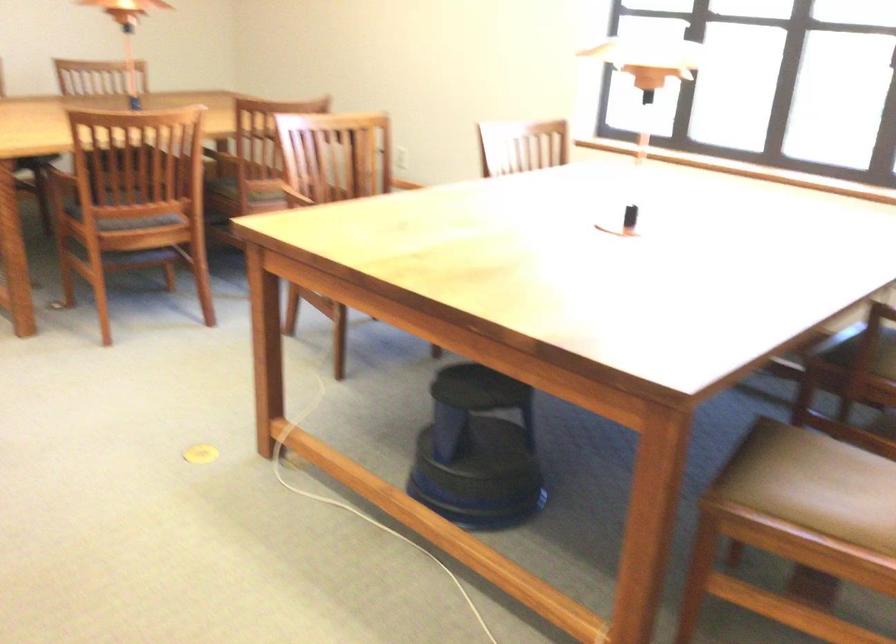
Where is `lamp pull switch`? The height and width of the screenshot is (644, 896). lamp pull switch is located at coordinates (640, 218).